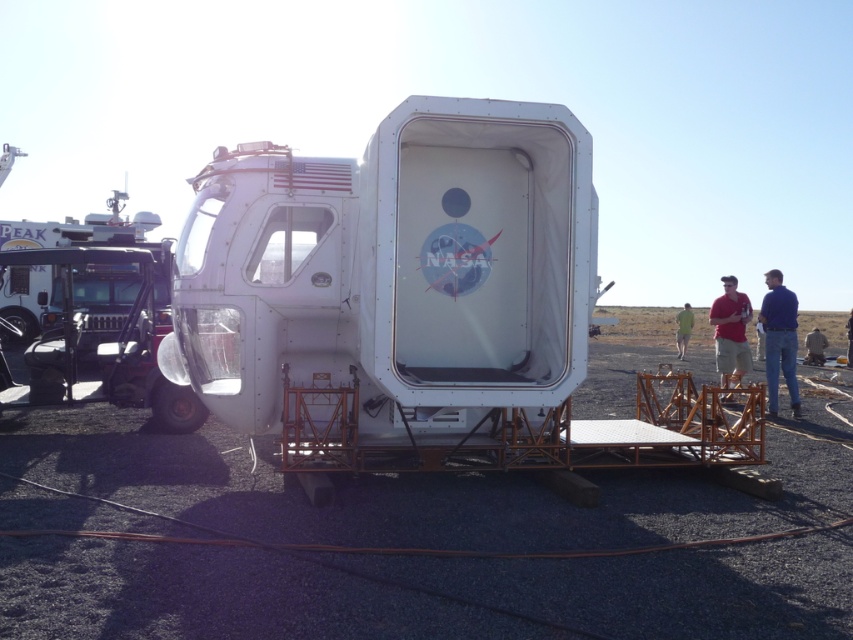
Looking at this image, you are standing in front of the NASA spacecraft module and see the blue jeans at right and the brown leather jacket at lower right. Which object is positioned more to the left?

The blue jeans at right is positioned more to the left than the brown leather jacket at lower right.

You are standing in front of the NASA spacecraft module and want to pick up both the blue jeans at right and the brown leather jacket at lower right. Which item should you reach for first to grab the one closer to you?

The blue jeans at right is closer to the viewer than the brown leather jacket at lower right, so you should reach for the blue jeans at right first.

You are standing in front of the NASA spacecraft module and see the blue jeans at right. Where exactly are the blue jeans located in relation to the module?

The blue jeans at right are located at point (779,340) relative to the module.